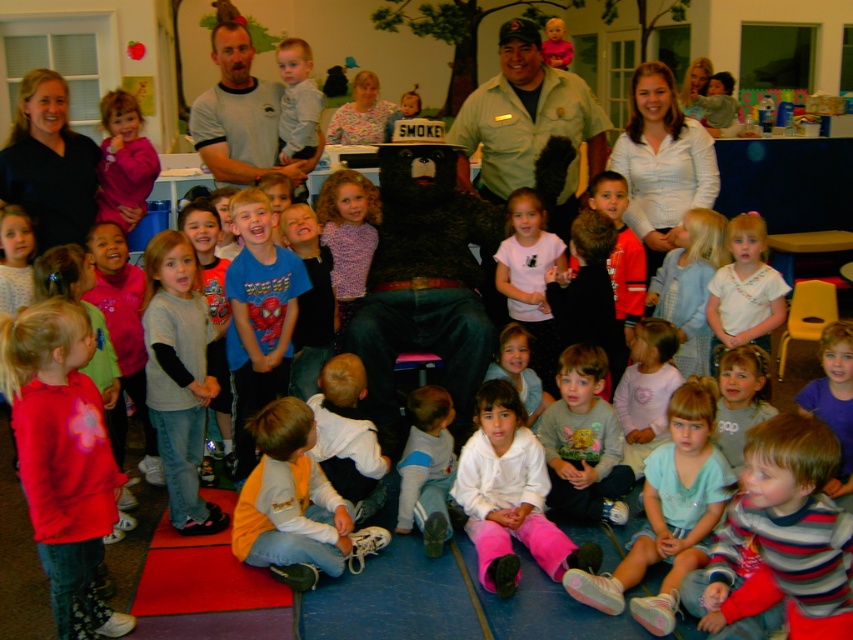
Question: Which point is closer to the camera?

Choices:
 (A) (70, 561)
 (B) (254, 88)
 (C) (132, 189)

Answer: (A)

Question: Which point is farther to the camera?

Choices:
 (A) (113, 506)
 (B) (514, 410)

Answer: (B)

Question: Is green uniform at center above gray fleece sweater at center?

Choices:
 (A) yes
 (B) no

Answer: (A)

Question: Does green uniform at center appear on the right side of matte pink sweater at left?

Choices:
 (A) yes
 (B) no

Answer: (A)

Question: Which point appears farthest from the camera in this image?

Choices:
 (A) (451, 476)
 (B) (115, 116)

Answer: (B)

Question: Is gray fleece sweater at center to the right of gray t-shirt at upper left from the viewer's perspective?

Choices:
 (A) no
 (B) yes

Answer: (A)